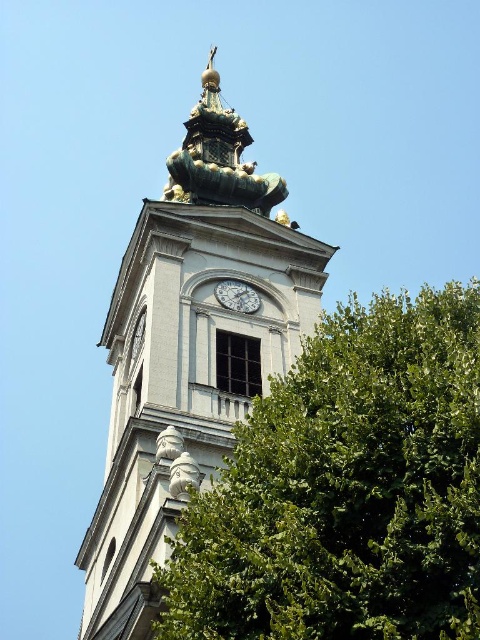
Does white stone clock tower at center have a smaller size compared to silver metallic clock at center?

Incorrect, white stone clock tower at center is not smaller in size than silver metallic clock at center.

In the scene shown: Can you confirm if white stone clock tower at center is taller than silver metallic clock at center?

Correct, white stone clock tower at center is much taller as silver metallic clock at center.

Measure the distance between white stone clock tower at center and camera.

119.22 feet

This screenshot has width=480, height=640. What are the coordinates of `white stone clock tower at center` in the screenshot? It's located at (189, 349).

Is green leafy tree at center shorter than white stone clock tower at center?

Yes, green leafy tree at center is shorter than white stone clock tower at center.

What do you see at coordinates (347, 488) in the screenshot? The width and height of the screenshot is (480, 640). I see `green leafy tree at center` at bounding box center [347, 488].

Which is behind, point (264, 570) or point (175, 520)?

Point (175, 520)

Find the location of a particular element. The height and width of the screenshot is (640, 480). green leafy tree at center is located at coordinates (347, 488).

Based on the photo, is green leafy tree at center above silver metallic clock at center?

No, green leafy tree at center is not above silver metallic clock at center.

Is the position of green leafy tree at center more distant than that of silver metallic clock at center?

No, it is not.

Is point (273, 474) positioned after point (254, 296)?

No, (273, 474) is closer to viewer.

The height and width of the screenshot is (640, 480). Identify the location of green leafy tree at center. (347, 488).